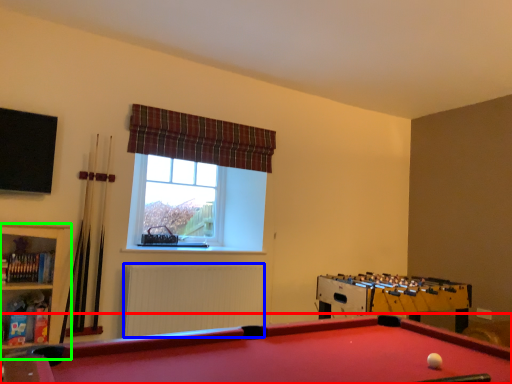
Question: Which object is the closest to the billiard table (highlighted by a red box)? Choose among these: radiator (highlighted by a blue box) or bookshelf (highlighted by a green box).

Choices:
 (A) radiator
 (B) bookshelf

Answer: (B)